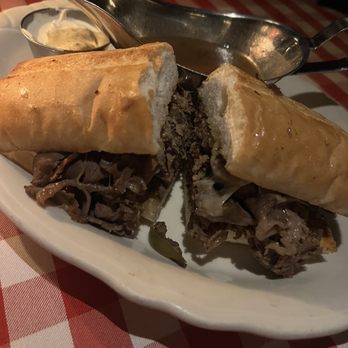
The height and width of the screenshot is (348, 348). In order to click on white plate in this screenshot , I will do `click(170, 301)`.